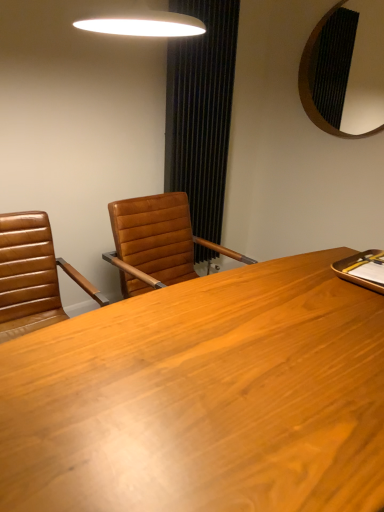
Question: From a real-world perspective, is black textured curtain at center over wooden desk at center?

Choices:
 (A) no
 (B) yes

Answer: (B)

Question: From a real-world perspective, is black textured curtain at center below wooden desk at center?

Choices:
 (A) yes
 (B) no

Answer: (B)

Question: Considering the relative sizes of black textured curtain at center and wooden desk at center in the image provided, is black textured curtain at center thinner than wooden desk at center?

Choices:
 (A) no
 (B) yes

Answer: (B)

Question: Can you confirm if black textured curtain at center is wider than wooden desk at center?

Choices:
 (A) no
 (B) yes

Answer: (A)

Question: Does black textured curtain at center come in front of wooden desk at center?

Choices:
 (A) no
 (B) yes

Answer: (A)

Question: Is point (329, 120) positioned closer to the camera than point (193, 202)?

Choices:
 (A) farther
 (B) closer

Answer: (A)

Question: From the image's perspective, is black textured mirror at upper right positioned above or below black textured curtain at center?

Choices:
 (A) above
 (B) below

Answer: (A)

Question: Is black textured mirror at upper right wider or thinner than black textured curtain at center?

Choices:
 (A) wide
 (B) thin

Answer: (B)

Question: Relative to black textured curtain at center, is black textured mirror at upper right in front or behind?

Choices:
 (A) front
 (B) behind

Answer: (A)

Question: Is black textured mirror at upper right spatially inside wooden desk at center, or outside of it?

Choices:
 (A) inside
 (B) outside

Answer: (B)

Question: Does point (327, 106) appear closer or farther from the camera than point (319, 282)?

Choices:
 (A) closer
 (B) farther

Answer: (B)

Question: Considering their positions, is black textured mirror at upper right located in front of or behind wooden desk at center?

Choices:
 (A) front
 (B) behind

Answer: (B)

Question: Considering the positions of black textured mirror at upper right and wooden desk at center in the image, is black textured mirror at upper right taller or shorter than wooden desk at center?

Choices:
 (A) tall
 (B) short

Answer: (A)

Question: From a real-world perspective, relative to brown leather chair at left, is black textured mirror at upper right vertically above or below?

Choices:
 (A) below
 (B) above

Answer: (B)

Question: In terms of height, does black textured mirror at upper right look taller or shorter compared to brown leather chair at left?

Choices:
 (A) tall
 (B) short

Answer: (A)